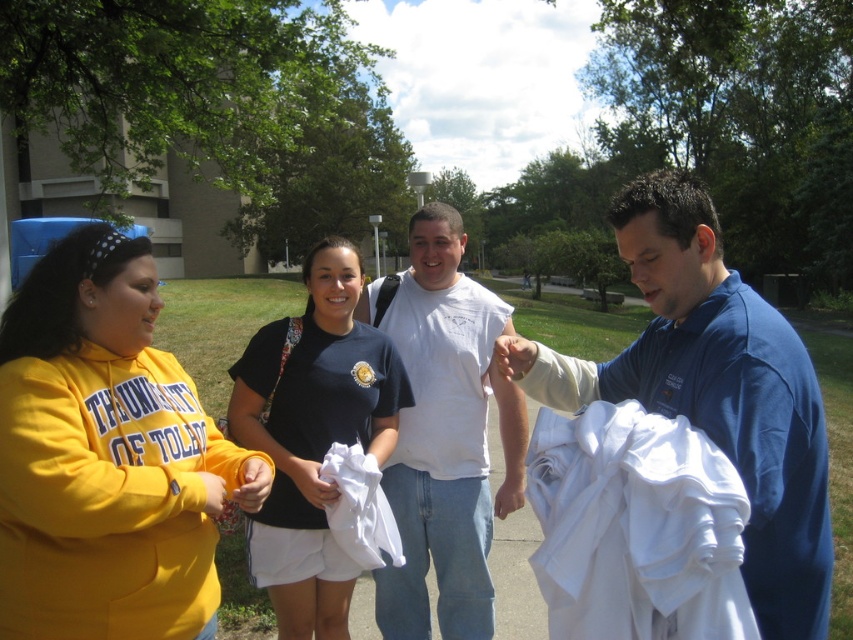
Question: Based on their relative distances, which object is nearer to the yellow fleece sweatshirt at left?

Choices:
 (A) white cotton t-shirt at center
 (B) white cotton shirt at right
 (C) blue cotton shirt at right

Answer: (B)

Question: Can you confirm if blue cotton shirt at right is wider than white cotton shirt at right?

Choices:
 (A) no
 (B) yes

Answer: (B)

Question: Which point is closer to the camera?

Choices:
 (A) navy blue t-shirt at center
 (B) yellow fleece sweatshirt at left
 (C) white cotton shirt at right

Answer: (C)

Question: Does yellow fleece sweatshirt at left have a greater width compared to white cotton cloth at center?

Choices:
 (A) no
 (B) yes

Answer: (B)

Question: Is yellow fleece sweatshirt at left wider than white cotton t-shirt at center?

Choices:
 (A) no
 (B) yes

Answer: (A)

Question: Which point is farther to the camera?

Choices:
 (A) (801, 385)
 (B) (137, 412)

Answer: (B)